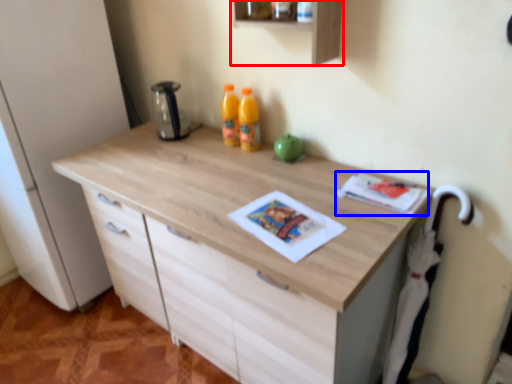
Question: Which object appears closest to the camera in this image, shelf (highlighted by a red box) or magazine (highlighted by a blue box)?

Choices:
 (A) shelf
 (B) magazine

Answer: (B)